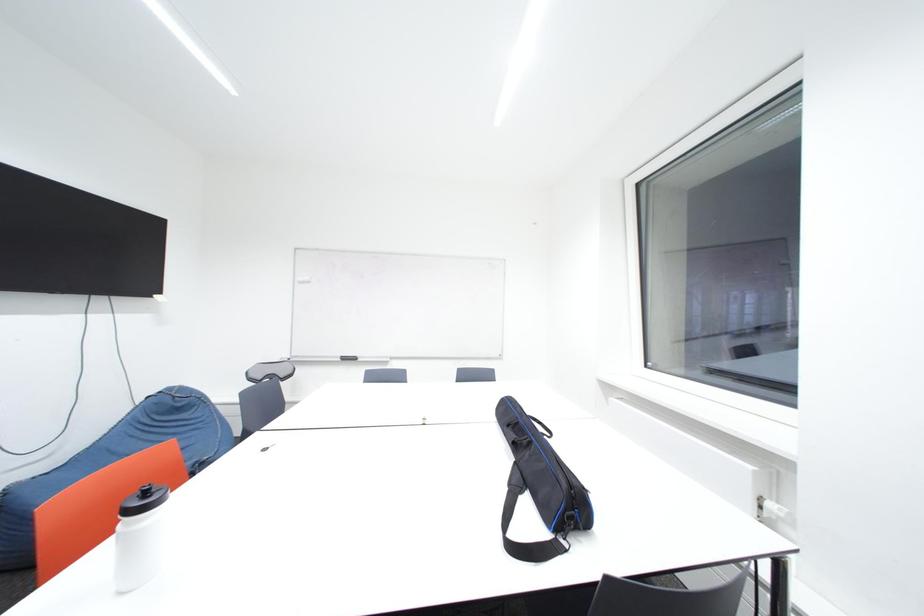
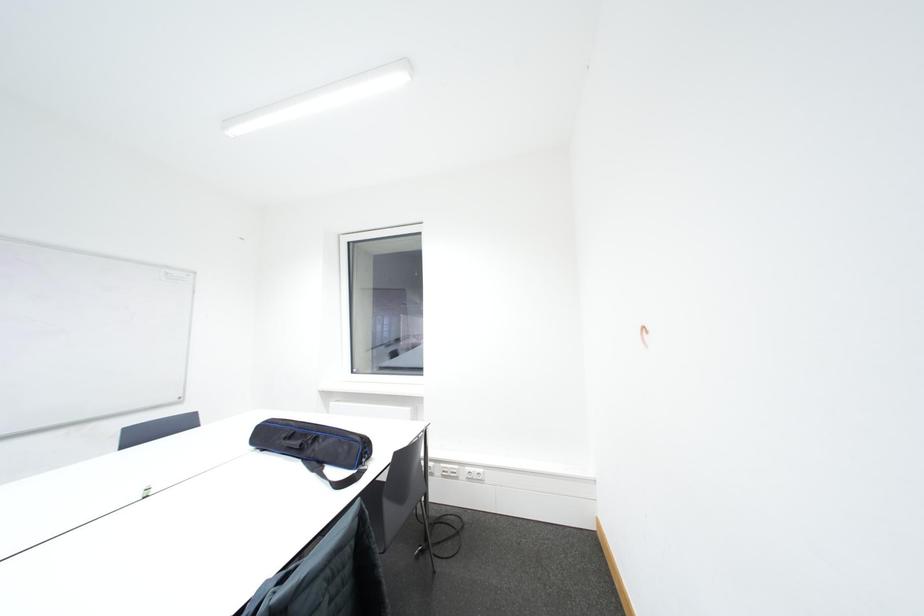
Question: The images are taken continuously from a first-person perspective. In which direction is your viewpoint rotating?

Choices:
 (A) Left
 (B) Right
 (C) Up
 (D) Down

Answer: (B)